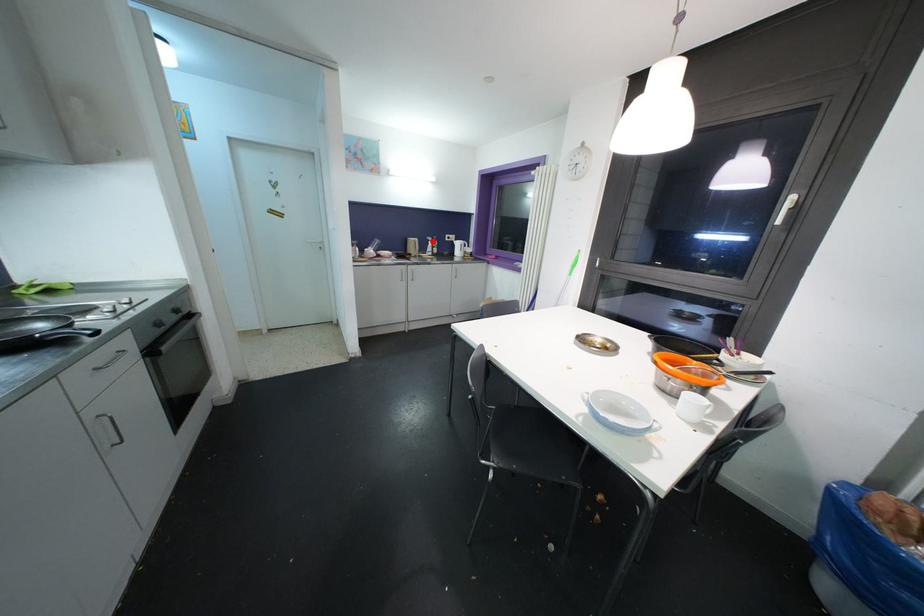
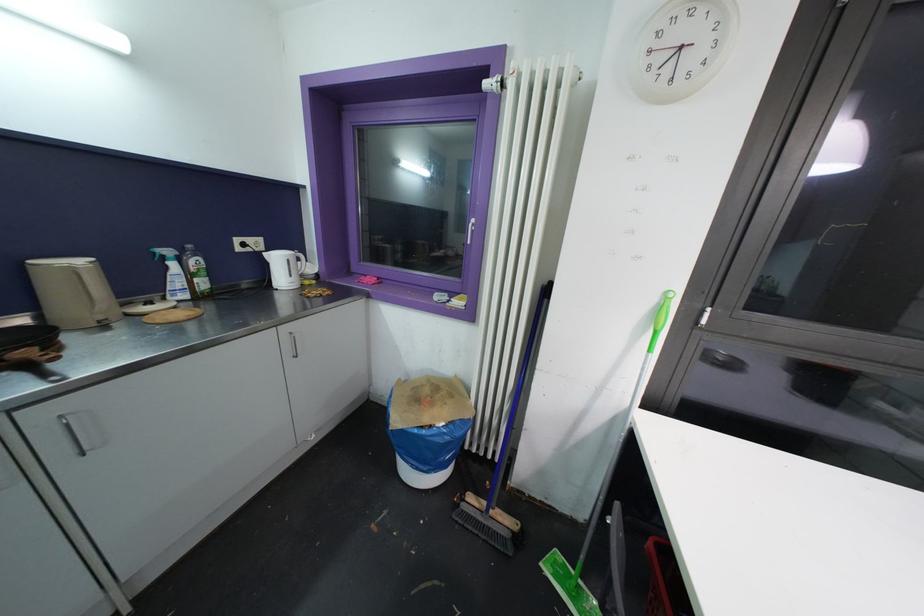
Question: I am providing you with two images of the same scene from different viewpoints. A red point is shown in image1. For the corresponding object point in image2, is it positioned nearer or farther from the camera?

Choices:
 (A) Nearer
 (B) Farther

Answer: (B)